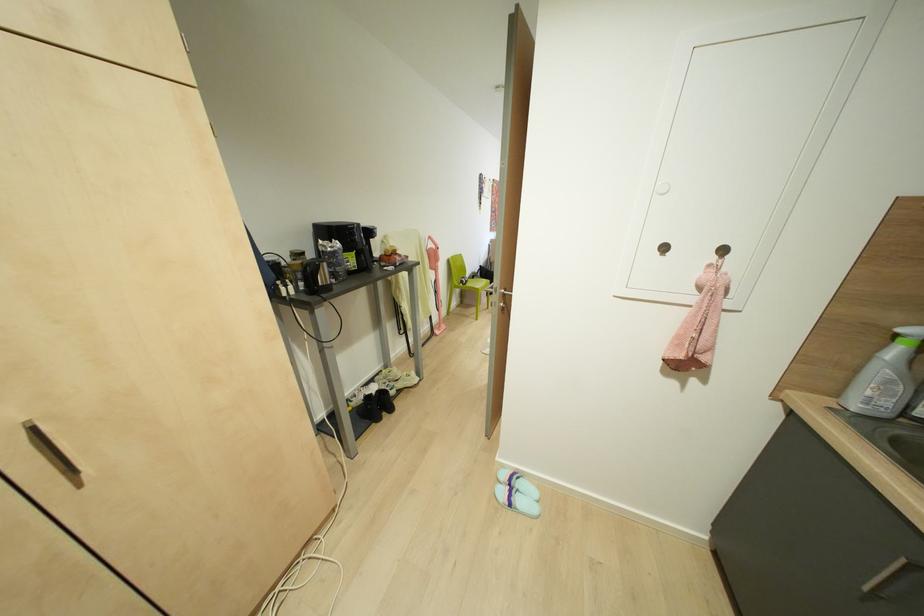
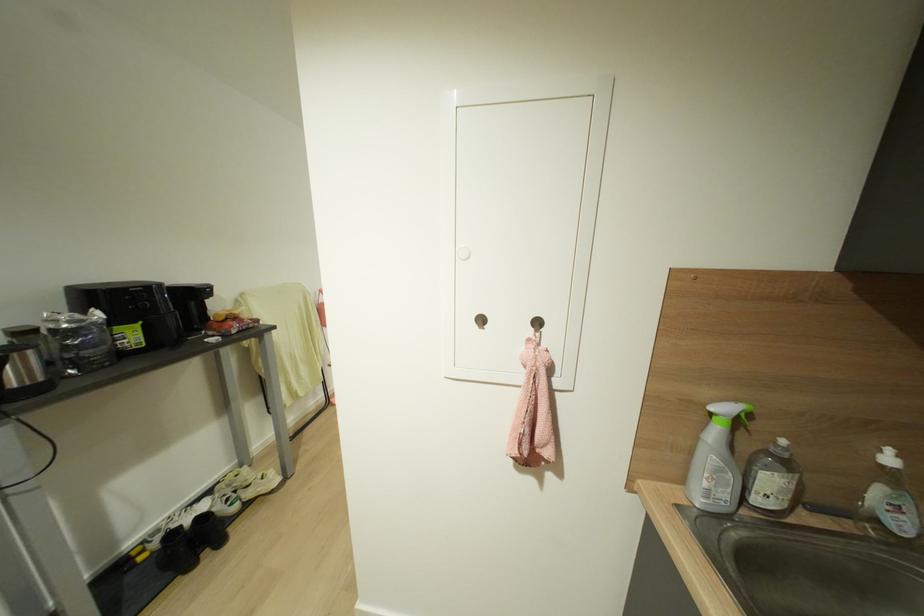
Question: I am providing you with two images of the same scene from different viewpoints. Which of the following objects are not visible in image2?

Choices:
 (A) green spray trigger
 (B) white cabinet knob
 (C) metal wall hook
 (D) none of these

Answer: (D)